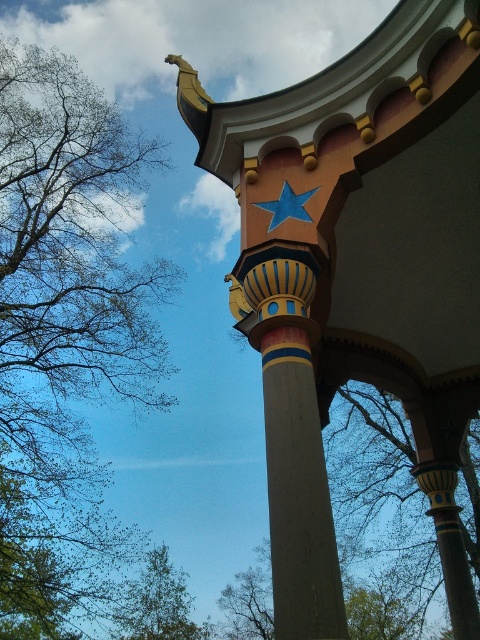
You are standing at the base of the main column in the architectural structure and see two points marked on the structure. The first point is at coordinate point (442, 45) and the second is at point (26, 464). Which point is closer to you?

Point (442, 45) is in front of point (26, 464), so the first point is closer to you.

You are an architect analyzing the structural integrity of the columns in the image. Given that the painted wood column at center is smaller in size than the smooth concrete column at center, which column would you recommend for supporting heavier loads and why?

The smooth concrete column at center should be recommended for supporting heavier loads because it has a larger size compared to the painted wood column at center, providing greater structural capacity.

You are standing in front of the architectural structure and want to take a photo of the green leafy tree at center. Where should you position yourself to ensure the tree is centered in your camera viewfinder?

To center the green leafy tree at center in your camera viewfinder, position yourself directly in front of the tree at the coordinates corresponding to its 2D location at point (407, 499).